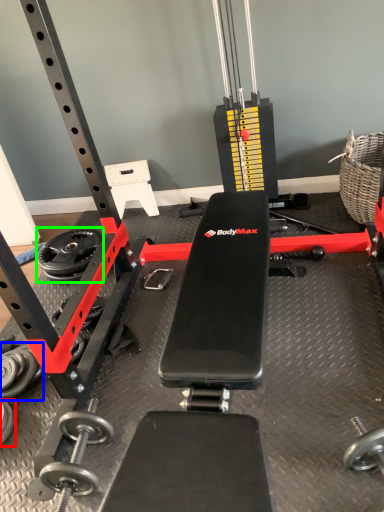
Question: Which object is positioned farthest from dumbbell (highlighted by a red box)? Select from dumbbell (highlighted by a blue box) and wheel (highlighted by a green box).

Choices:
 (A) dumbbell
 (B) wheel

Answer: (B)